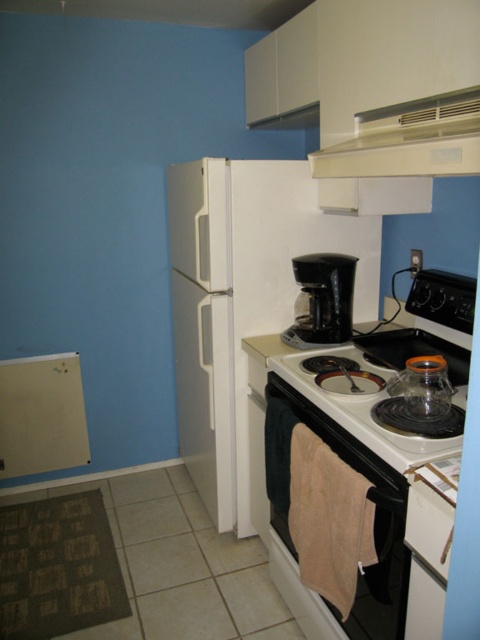
You are standing in the kitchen and want to reach both the white plastic exhaust hood at upper center and the black plastic coffee maker at center. Which one do you need to move forward more to touch?

You need to move forward more to touch the black plastic coffee maker at center because the white plastic exhaust hood at upper center is closer to the viewer, so it requires less movement to reach.

You are standing in the kitchen and want to reach both points. Which point, point (x=432, y=164) or point (x=330, y=340), is closer to you?

Point (x=432, y=164) is closer to you than point (x=330, y=340).

You are a chef preparing breakfast and need to place both the white glossy gas stove at center and the black plastic coffee maker at center on the counter. Which one should you place to the left to match the image?

The black plastic coffee maker at center should be placed to the left of the white glossy gas stove at center because the white glossy gas stove at center is positioned on the right side of the black plastic coffee maker at center in the image.